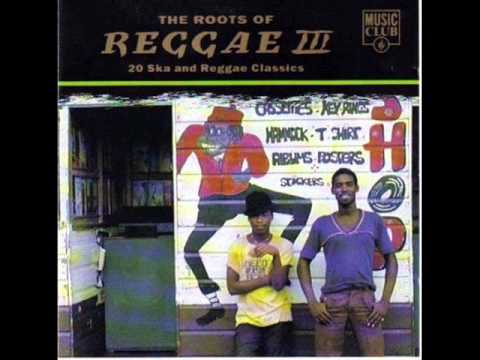
The width and height of the screenshot is (480, 360). I want to click on pictures, so click(x=156, y=203), click(x=135, y=197), click(x=74, y=198), click(x=94, y=192).